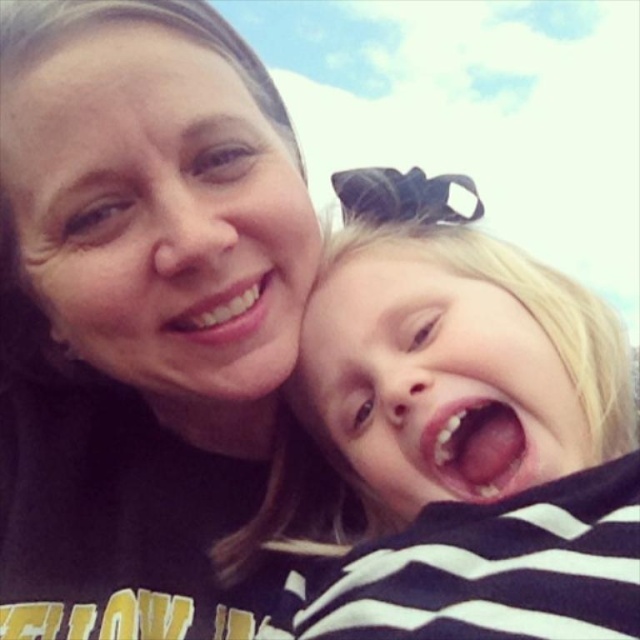
You are a fashion designer who needs to create matching accessories for the two individuals in the photo. Given that the matte black shirt at center is larger than the striped fabric shirt at right, which individual should you design the accessory to be slightly smaller for?

You should design the accessory to be slightly smaller for the striped fabric shirt at right because the matte black shirt at center is larger, so the accessory for the striped fabric shirt at right needs to be proportionally smaller to maintain balance.